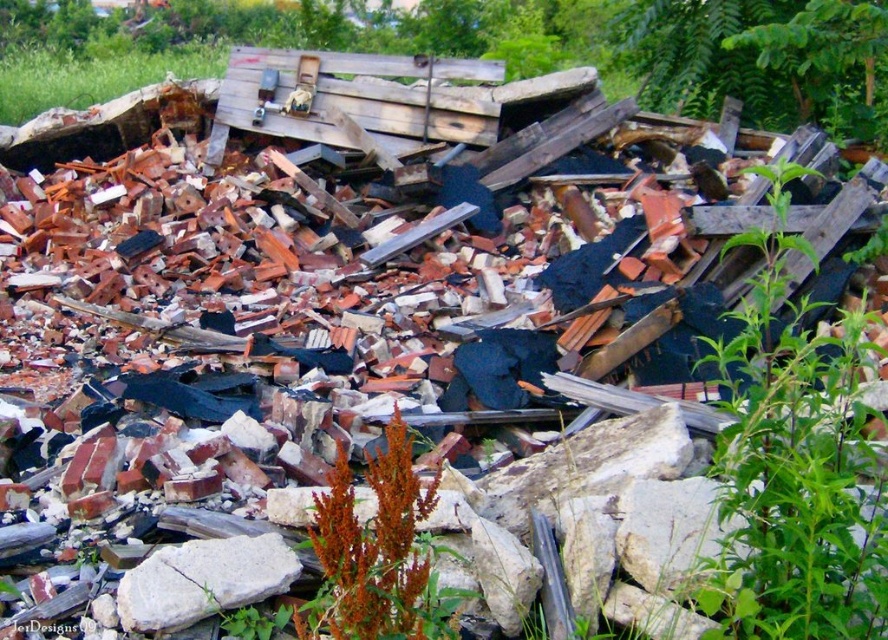
Question: Is green leafy plant at upper right wider than brown fuzzy plant at center?

Choices:
 (A) yes
 (B) no

Answer: (A)

Question: Which point is closer to the camera?

Choices:
 (A) green leafy plant at upper right
 (B) brown fuzzy plant at center
 (C) white rough stone at center

Answer: (A)

Question: From the image, what is the correct spatial relationship of green leafy plant at upper right in relation to white rough stone at center?

Choices:
 (A) right
 (B) left

Answer: (A)

Question: Observing the image, what is the correct spatial positioning of green leafy plant at upper right in reference to white rough stone at center?

Choices:
 (A) above
 (B) below

Answer: (A)

Question: Which point is closer to the camera?

Choices:
 (A) white rough stone at center
 (B) green leafy plant at upper right
 (C) brown fuzzy plant at center

Answer: (B)

Question: Which point appears closest to the camera in this image?

Choices:
 (A) (736, 554)
 (B) (401, 618)

Answer: (B)